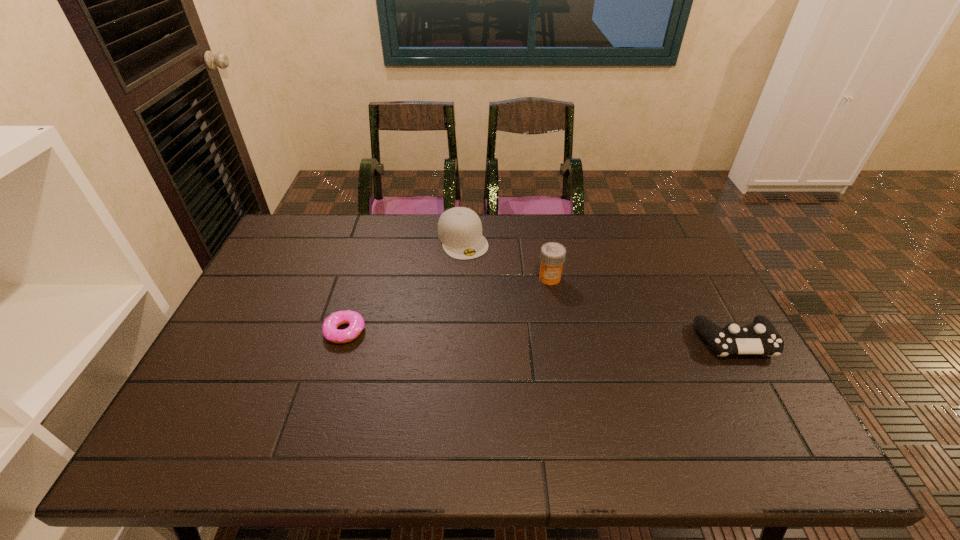
Where is `free space on the desktop that is between the shortest object and the rightmost object and is positioned on the label side of the medicine`? The image size is (960, 540). free space on the desktop that is between the shortest object and the rightmost object and is positioned on the label side of the medicine is located at coordinates (490, 335).

Where is `vacant space on the desktop that is between the doughnut and the rightmost object and is positioned on the front-facing side of the third shortest object`? The width and height of the screenshot is (960, 540). vacant space on the desktop that is between the doughnut and the rightmost object and is positioned on the front-facing side of the third shortest object is located at coordinates (514, 335).